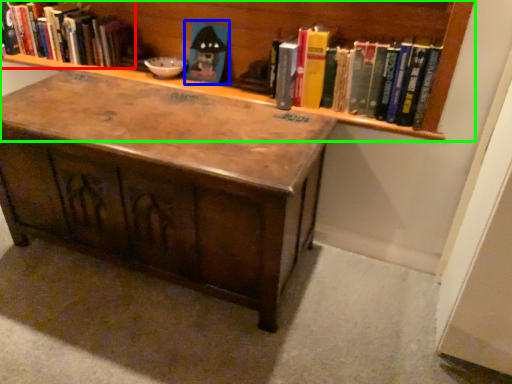
Question: Which is nearer to the book (highlighted by a red box)? toy (highlighted by a blue box) or bookcase (highlighted by a green box).

Choices:
 (A) toy
 (B) bookcase

Answer: (B)